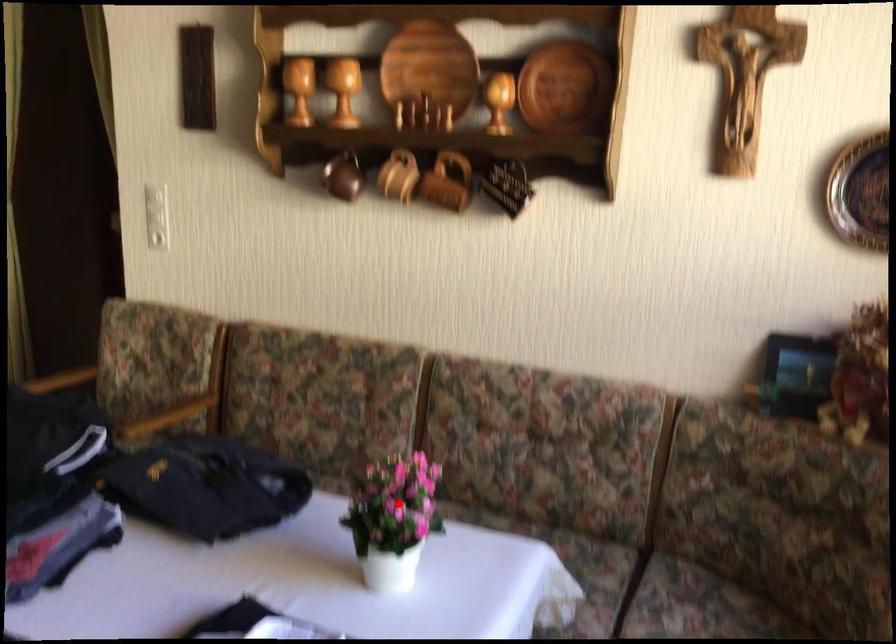
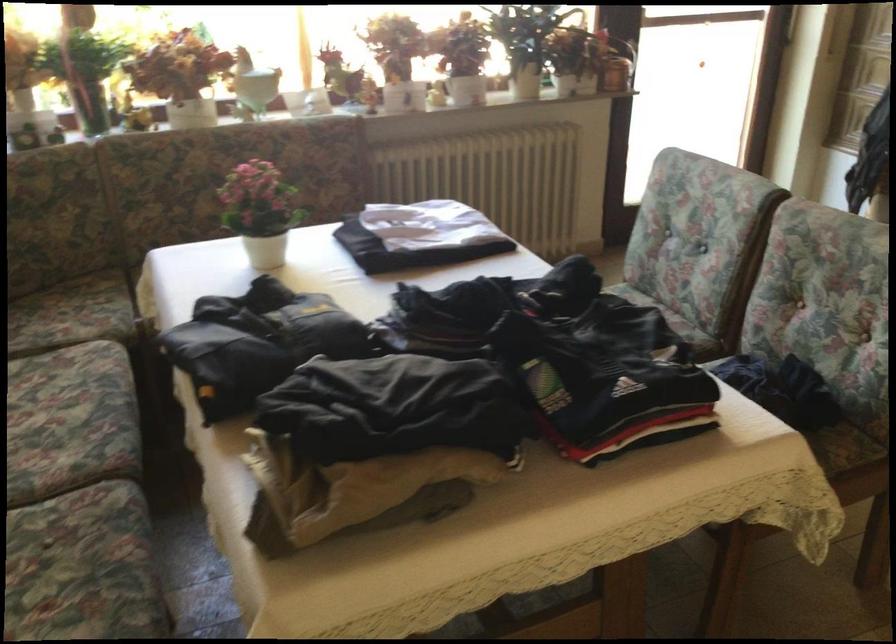
Find the pixel in the second image that matches the highlighted location in the first image.

(261, 212)